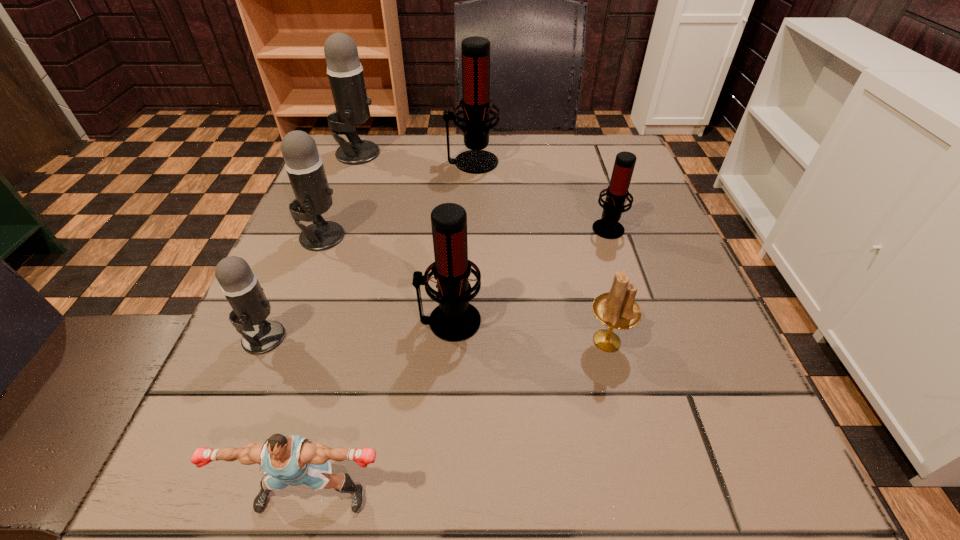
Select which object is the sixth closest to the second smallest red microphone. Please provide its 2D coordinates. Your answer should be formatted as a tuple, i.e. [(x, y)], where the tuple contains the x and y coordinates of a point satisfying the conditions above.

[(476, 103)]

Locate an element on the screen. This screenshot has height=540, width=960. the fourth closest microphone relative to the biggest red microphone is located at coordinates (455, 319).

Find the location of a particular element. The width and height of the screenshot is (960, 540). microphone that is the second closest to the biggest gray microphone is located at coordinates (304, 166).

Point out which gray microphone is positioned as the nearest to the nearest gray microphone. Please provide its 2D coordinates. Your answer should be formatted as a tuple, i.e. [(x, y)], where the tuple contains the x and y coordinates of a point satisfying the conditions above.

[(304, 166)]

I want to click on gray microphone that stands as the closest to the red puncher, so click(x=239, y=284).

Identify the location of the second closest red microphone to the second smallest gray microphone. (476, 103).

Identify which red microphone is the third nearest to the biggest gray microphone. Please provide its 2D coordinates. Your answer should be formatted as a tuple, i.e. [(x, y)], where the tuple contains the x and y coordinates of a point satisfying the conditions above.

[(608, 227)]

Locate an element on the screen. The width and height of the screenshot is (960, 540). free space that satisfies the following two spatial constraints: 1. on the front side of the second biggest gray microphone; 2. on the left side of the candle holder is located at coordinates (280, 341).

Where is `vacant region that satisfies the following two spatial constraints: 1. on the front side of the candle holder; 2. on the left side of the second smallest gray microphone`? vacant region that satisfies the following two spatial constraints: 1. on the front side of the candle holder; 2. on the left side of the second smallest gray microphone is located at coordinates (280, 341).